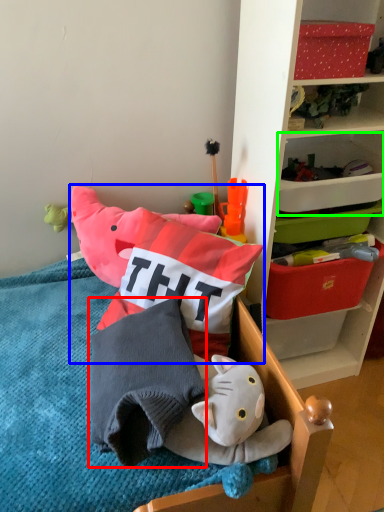
Question: Which object is the closest to the pillow (highlighted by a red box)? Choose among these: toy (highlighted by a blue box) or storage box (highlighted by a green box).

Choices:
 (A) toy
 (B) storage box

Answer: (A)